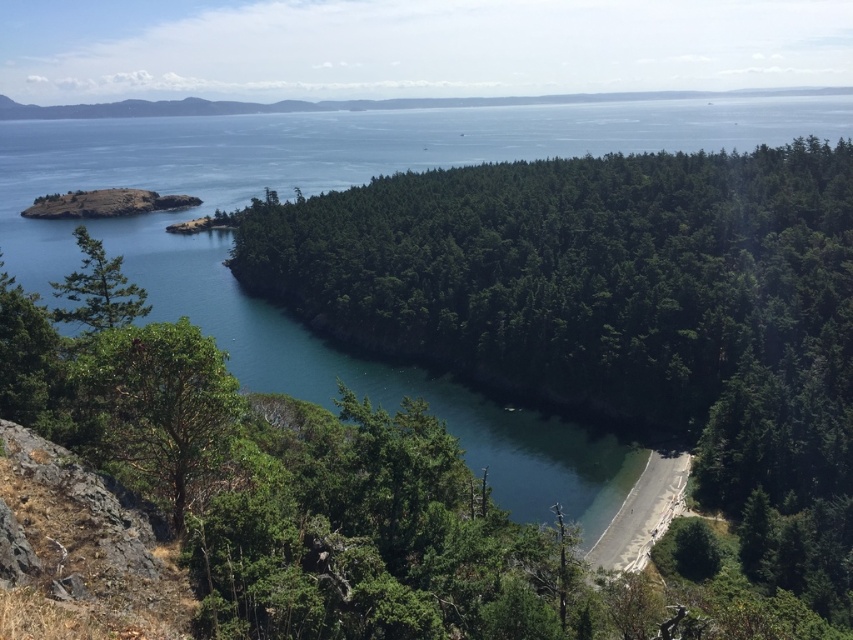
Question: In this image, where is green rough bark tree at lower left located relative to green matte tree at left?

Choices:
 (A) right
 (B) left

Answer: (A)

Question: Can you confirm if green rough bark tree at lower left is bigger than green matte tree at left?

Choices:
 (A) yes
 (B) no

Answer: (A)

Question: Based on their relative distances, which object is nearer to the green matte tree at left?

Choices:
 (A) smooth sand beach at lower center
 (B) green rough bark tree at lower left
 (C) green leafy tree at center

Answer: (B)

Question: Which object is the closest to the green matte tree at left?

Choices:
 (A) smooth sand beach at lower center
 (B) green rough bark tree at lower left
 (C) green leafy tree at center

Answer: (B)

Question: Is green leafy tree at center thinner than smooth sand beach at lower center?

Choices:
 (A) no
 (B) yes

Answer: (A)

Question: Which object appears farthest from the camera in this image?

Choices:
 (A) green leafy tree at center
 (B) green matte tree at left

Answer: (A)